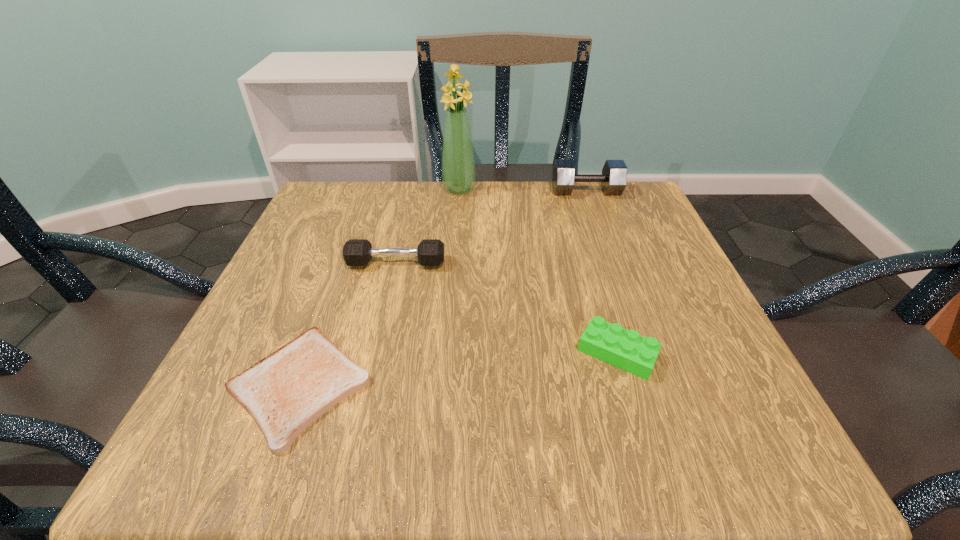
Locate an element on the screen. This screenshot has height=540, width=960. free region located on the right of the fourth tallest object is located at coordinates (695, 353).

You are a GUI agent. You are given a task and a screenshot of the screen. Output one action in this format:
    pyautogui.click(x=<x>, y=<y>)
    Task: Click on the vacant space located 0.260m on the right of the toast
    This screenshot has width=960, height=540.
    Given the screenshot: What is the action you would take?
    pyautogui.click(x=546, y=386)

Find the location of a particular element. This screenshot has height=540, width=960. bouquet situated at the far edge is located at coordinates (458, 165).

I want to click on dumbbell at the far edge, so click(613, 179).

Find the location of a particular element. object positioned at the near edge is located at coordinates (285, 392).

Find the location of a particular element. The height and width of the screenshot is (540, 960). dumbbell situated at the left edge is located at coordinates (356, 252).

Identify the location of toast positioned at the left edge. This screenshot has height=540, width=960. click(x=285, y=392).

This screenshot has height=540, width=960. What are the coordinates of `dumbbell located in the right edge section of the desktop` in the screenshot? It's located at (613, 179).

Locate an element on the screen. Lego that is at the right edge is located at coordinates (625, 349).

I want to click on object that is at the near left corner, so (285, 392).